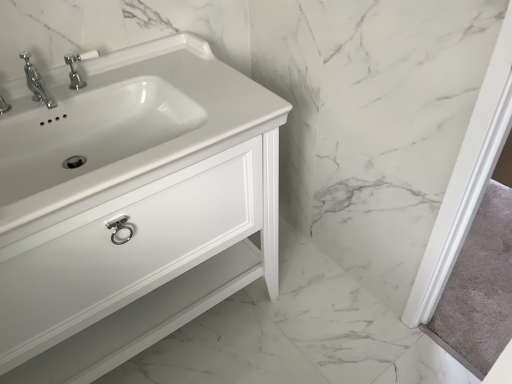
Locate an element on the screen. The height and width of the screenshot is (384, 512). vacant area that is situated to the right of white ceramic tap at upper left is located at coordinates (143, 79).